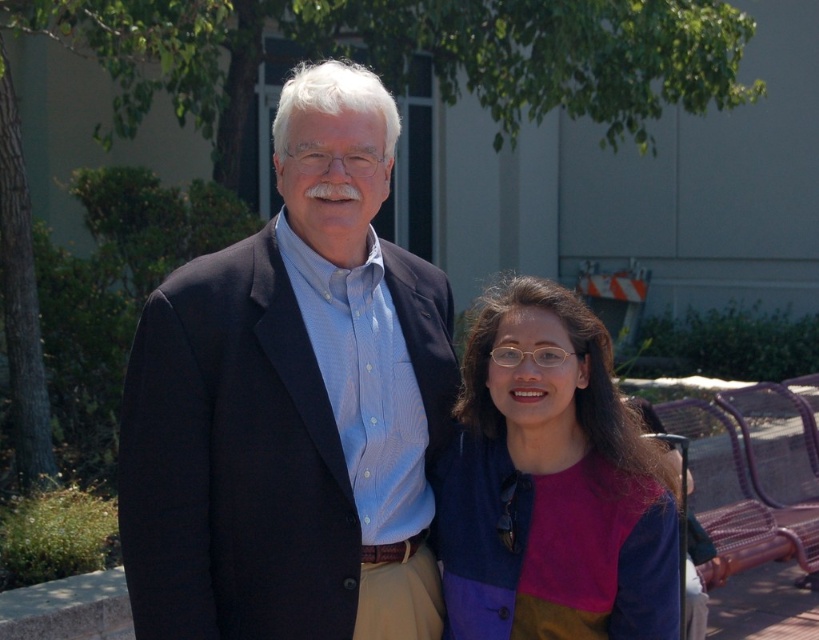
You are taking a photo of two points in a park scene. The first point is at coordinates point (376, 410) and the second point is at point (465, 381). Which point is nearer to the camera?

Point (376, 410) is closer to the camera than point (465, 381).

In the scene shown: You are a photographer setting up for a group photo. You have two subjects wearing the matte black suit at center and the multicolored fabric jacket at center. Since you want to ensure the subjects are spaced appropriately, which subject should you position farther from the camera to avoid overcrowding?

The matte black suit at center should be positioned farther from the camera because its width is larger than the multicolored fabric jacket at center, which would help prevent overcrowding by creating more space between them.

You are a photographer setting up a shoot in a park. You need to place a matte black suit at center and a multicolored fabric jacket at center for a photoshoot. According to the scene, which object should be placed higher to ensure they are arranged as in the original image?

The matte black suit at center should be placed higher than the multicolored fabric jacket at center because the matte black suit at center is positioned over the multicolored fabric jacket at center in the original image.